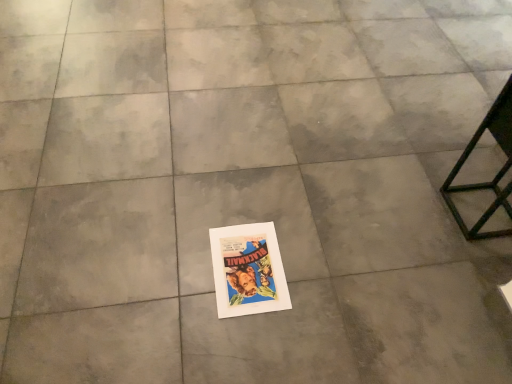
The height and width of the screenshot is (384, 512). I want to click on free space to the back side of vibrant paper poster at center, so click(x=253, y=205).